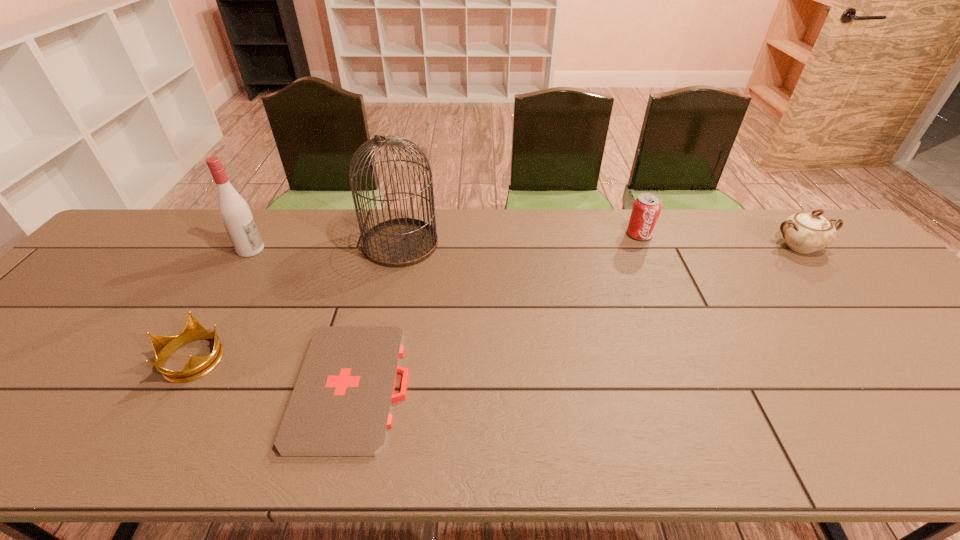
Identify the location of free location at the near edge. This screenshot has height=540, width=960. (761, 424).

At what (x,y) coordinates should I click in order to perform the action: click on vacant position at the left edge of the desktop. Please return your answer as a coordinate pair (x, y). Looking at the image, I should click on (79, 308).

In the image, there is a desktop. Where is `vacant space at the right edge`? The height and width of the screenshot is (540, 960). vacant space at the right edge is located at coordinates (817, 261).

Identify the location of free area in between the chinaware and the soda can. This screenshot has width=960, height=540. (719, 240).

Identify the location of vacant space that is in between the first-aid kit and the soda can. (496, 310).

Identify the location of empty space between the soda can and the alcohol. (445, 242).

This screenshot has width=960, height=540. What are the coordinates of `free spot between the alcohol and the rightmost object` in the screenshot? It's located at (525, 248).

Where is `free space between the second tallest object and the first-aid kit`? The width and height of the screenshot is (960, 540). free space between the second tallest object and the first-aid kit is located at coordinates (302, 318).

Find the location of a particular element. free spot between the second tallest object and the soda can is located at coordinates (445, 242).

Locate an element on the screen. This screenshot has height=540, width=960. free space that is in between the soda can and the rightmost object is located at coordinates (719, 240).